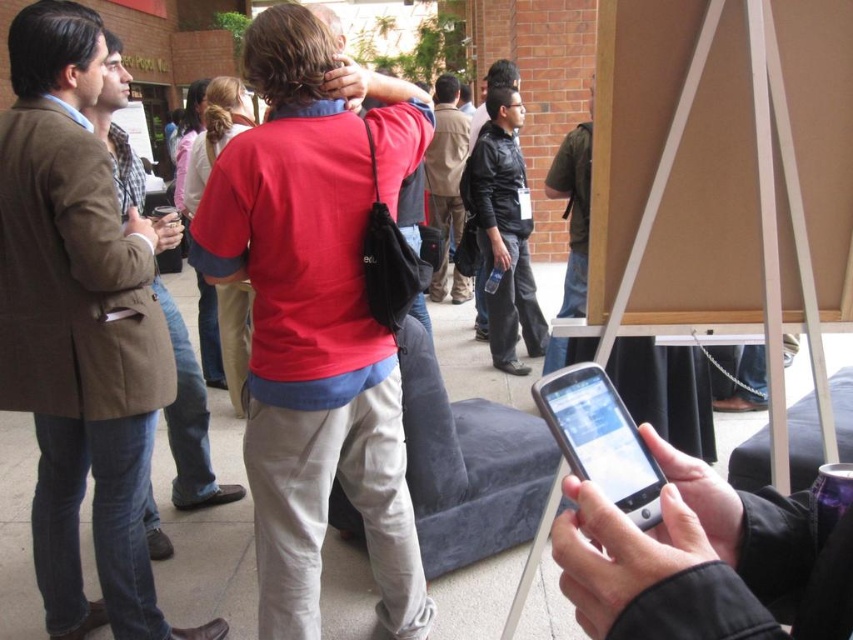
You are standing at the center of the image and want to hand a document to the person wearing the black leather jacket at center. In which direction should you move to approach them?

The black leather jacket at center is already at the center of the image, so you don not need to move in any specific direction to approach them. You are already at the same central location.

From the picture: You are at an event and need to identify the clothing items worn by the central figure. Which of the two shirts, the matte red shirt at center or the dark green shirt at center, is more prominent in size?

The matte red shirt at center is larger in size than the dark green shirt at center, so the matte red shirt at center is more prominent in size.